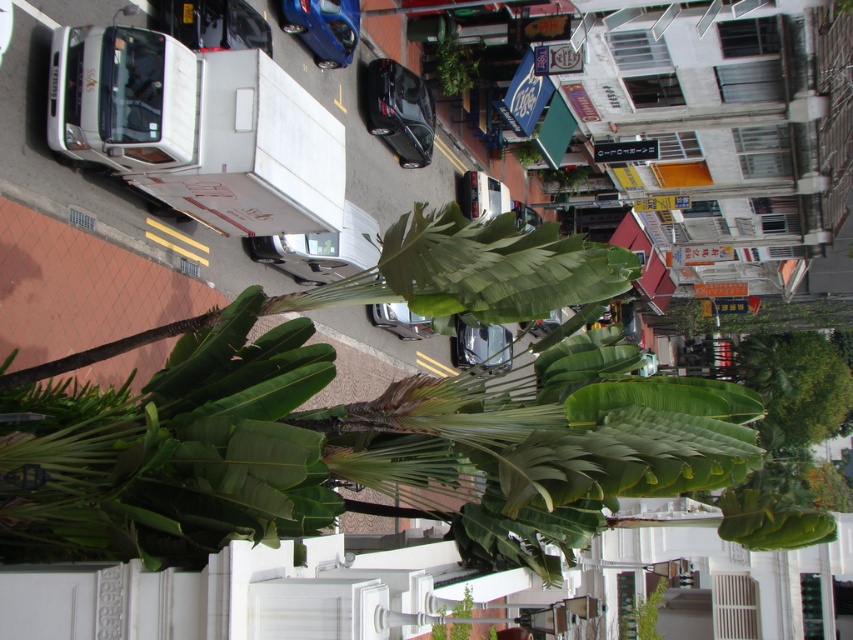
Between green leafy banana tree at center and shiny black car at center, which one is positioned lower?

green leafy banana tree at center is lower down.

Between green leafy banana tree at center and shiny black car at center, which one appears on the left side from the viewer's perspective?

shiny black car at center is more to the left.

Is point (405, 413) closer to camera compared to point (392, 93)?

Yes.

You are a GUI agent. You are given a task and a screenshot of the screen. Output one action in this format:
    pyautogui.click(x=<x>, y=<y>)
    Task: Click on the green leafy banana tree at center
    This screenshot has width=853, height=640.
    Given the screenshot: What is the action you would take?
    pyautogui.click(x=392, y=420)

Which is in front, point (370, 108) or point (645, 604)?

Positioned in front is point (645, 604).

Is point (419, 99) positioned in front of point (654, 589)?

No.

Between point (416, 86) and point (624, 636), which one is positioned in front?

Point (624, 636) is in front.

At what (x,y) coordinates should I click in order to perform the action: click on shiny black car at center. Please return your answer as a coordinate pair (x, y). The height and width of the screenshot is (640, 853). Looking at the image, I should click on (399, 109).

What do you see at coordinates (399, 109) in the screenshot?
I see `shiny black car at center` at bounding box center [399, 109].

Is shiny black car at center positioned before blue metallic car at upper center?

No, shiny black car at center is behind blue metallic car at upper center.

Is point (392, 99) farther from viewer compared to point (352, 28)?

Yes, point (392, 99) is behind point (352, 28).

You are a GUI agent. You are given a task and a screenshot of the screen. Output one action in this format:
    pyautogui.click(x=<x>, y=<y>)
    Task: Click on the shiny black car at center
    The image size is (853, 640).
    Given the screenshot: What is the action you would take?
    tap(399, 109)